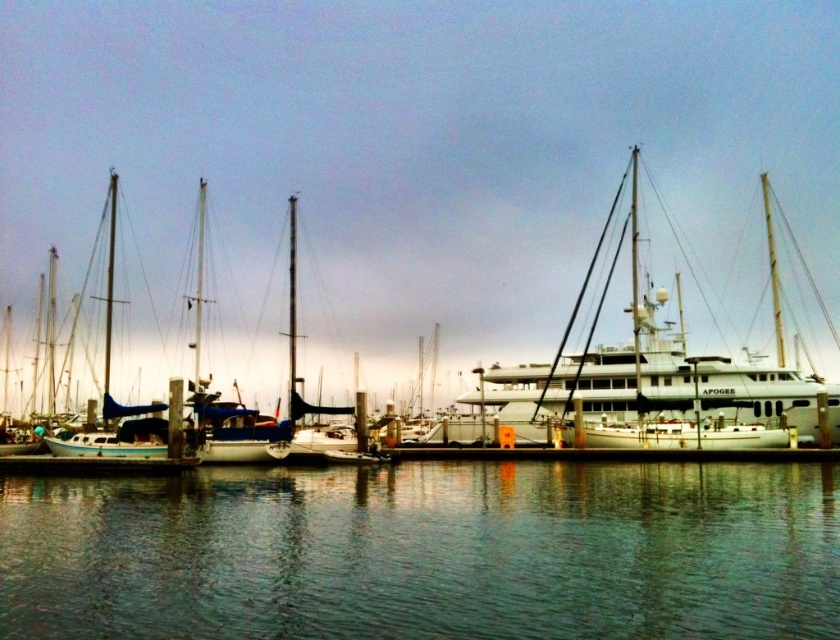
Can you confirm if green reflective water at lower center is positioned below white glossy yacht at center?

Yes, green reflective water at lower center is below white glossy yacht at center.

Which is above, green reflective water at lower center or white glossy yacht at center?

Positioned higher is white glossy yacht at center.

Does point (672, 484) lie in front of point (468, 438)?

Yes.

At what (x,y) coordinates should I click in order to perform the action: click on green reflective water at lower center. Please return your answer as a coordinate pair (x, y). Looking at the image, I should click on (426, 552).